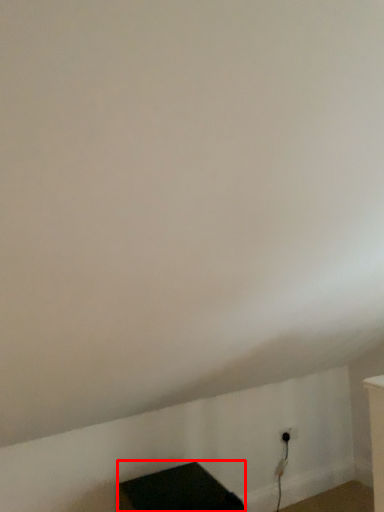
Question: From the image's perspective, what is the correct spatial positioning of furniture (annotated by the red box) in reference to electric outlet?

Choices:
 (A) above
 (B) below

Answer: (B)